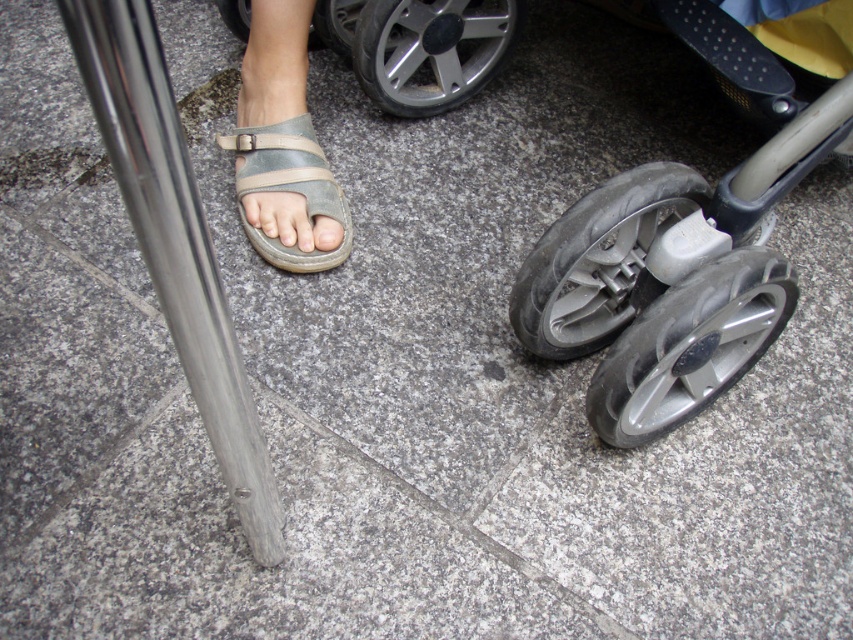
Which of these two, silver metallic wheel at center or gray matte toe at center, stands shorter?

Standing shorter between the two is silver metallic wheel at center.

Measure the distance between silver metallic wheel at center and camera.

The distance of silver metallic wheel at center from camera is 1.23 meters.

At what (x,y) coordinates should I click in order to perform the action: click on silver metallic wheel at center. Please return your answer as a coordinate pair (x, y). Looking at the image, I should click on (430, 51).

Which is below, polished metal pole at left or leather sandal at center?

polished metal pole at left

Which is in front, point (213, 355) or point (317, 262)?

Point (213, 355) is in front.

Locate an element on the screen. The height and width of the screenshot is (640, 853). polished metal pole at left is located at coordinates (175, 243).

Is black rubber wheel at lower right shorter than rubber/smooth tire at center?

Incorrect, black rubber wheel at lower right's height does not fall short of rubber/smooth tire at center's.

Is point (573, 218) in front of point (309, 28)?

Yes, it is in front of point (309, 28).

I want to click on black rubber wheel at lower right, so click(598, 259).